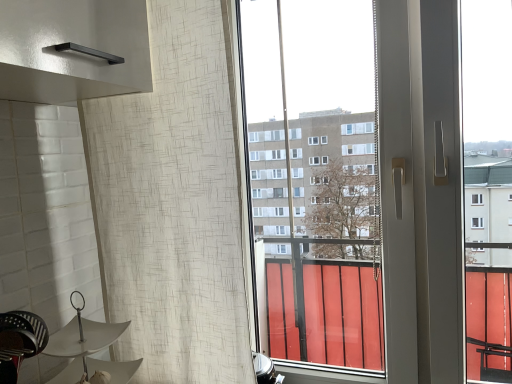
Question: Looking at their shapes, would you say metallic black swivel chair at lower left is wider or thinner than white matte umbrella at lower left?

Choices:
 (A) thin
 (B) wide

Answer: (A)

Question: Visually, is metallic black swivel chair at lower left positioned to the left or to the right of white matte umbrella at lower left?

Choices:
 (A) right
 (B) left

Answer: (B)

Question: Which object is the farthest from the metallic black swivel chair at lower left?

Choices:
 (A) white textured curtain at left
 (B) white matte umbrella at lower left

Answer: (A)

Question: Estimate the real-world distances between objects in this image. Which object is farther from the metallic black swivel chair at lower left?

Choices:
 (A) white matte umbrella at lower left
 (B) white textured curtain at left

Answer: (B)